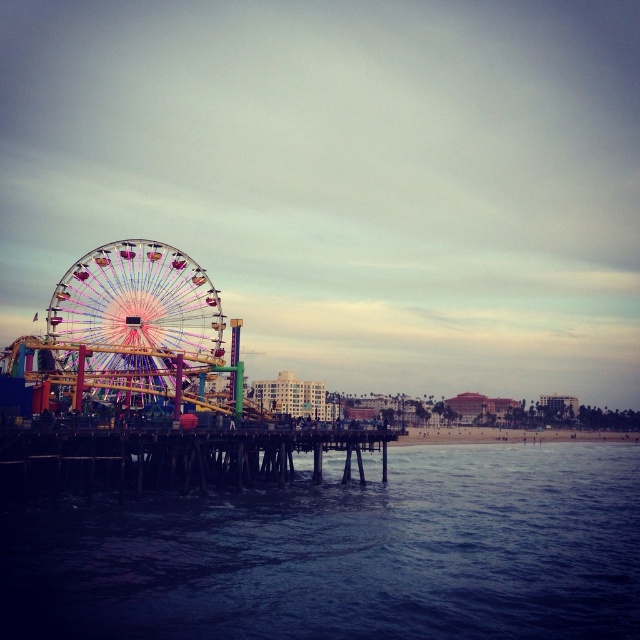
You are standing on the sandy beach at lower center and want to reach the wooden at center. Which direction should you walk to get there?

You should walk to your left since the wooden at center is located to the left of the sandy beach at lower center.

You are standing on the sandy beach at lower center and want to take a photo of the multicolored metallic ferris wheel at left. Since the ferris wheel is positioned over the sandy beach, where should you position yourself to ensure the ferris wheel is fully visible in your photo?

Since the multicolored metallic ferris wheel at left is positioned over the sandy beach at lower center, you should position yourself further away from the sandy beach at lower center to ensure the ferris wheel is fully visible in your photo.

You are standing on the sandy beach at lower center and looking towards the multicolored metallic ferris wheel at left. Which object is taller?

The multicolored metallic ferris wheel at left is taller than the sandy beach at lower center.